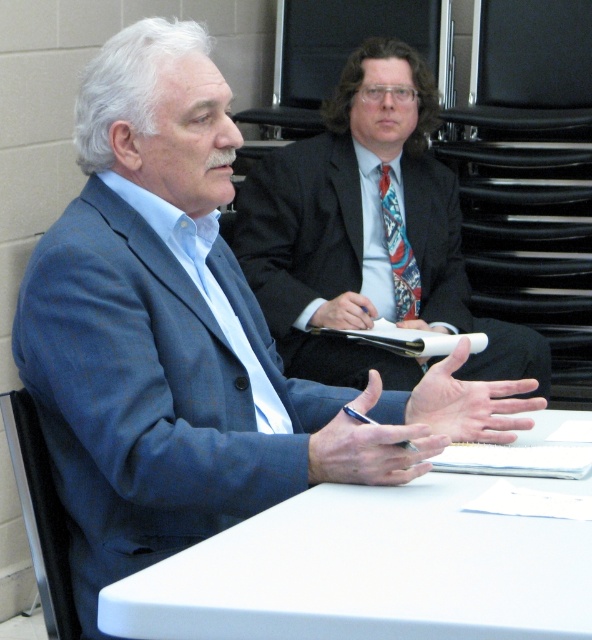
You are organizing a formal event and need to ensure there is enough space between the dark blue wool suit at center and the multicolored woven tie at center for a name tag. The name tag requires 20 centimeters of space. Can the name tag be placed between them?

The dark blue wool suit at center and multicolored woven tie at center are 21.49 centimeters apart, which is more than the required 20 centimeters. Therefore, the name tag can be placed between them.

You are an event planner organizing a seating arrangement for a formal event. You need to place a dark blue wool suit at center and a multicolored woven tie at center on a shelf. The shelf has a height limit of 1.5 meters. Can both items be placed without exceeding the height limit?

The dark blue wool suit at center has a greater height compared to multicolored woven tie at center. However, since the height of both items combined is not provided, it is impossible to determine if they exceed the shelf height limit of 1.5 meters. Please provide more information about their individual heights.